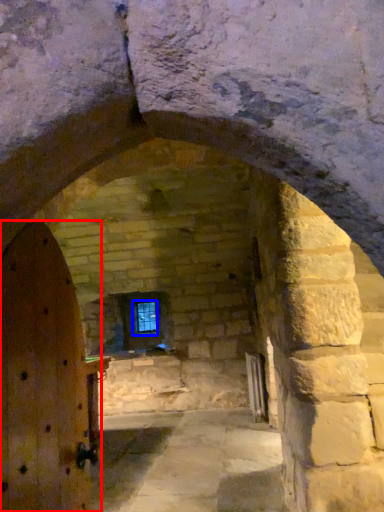
Question: Which object is closer to the camera taking this photo, door (highlighted by a red box) or window (highlighted by a blue box)?

Choices:
 (A) door
 (B) window

Answer: (A)